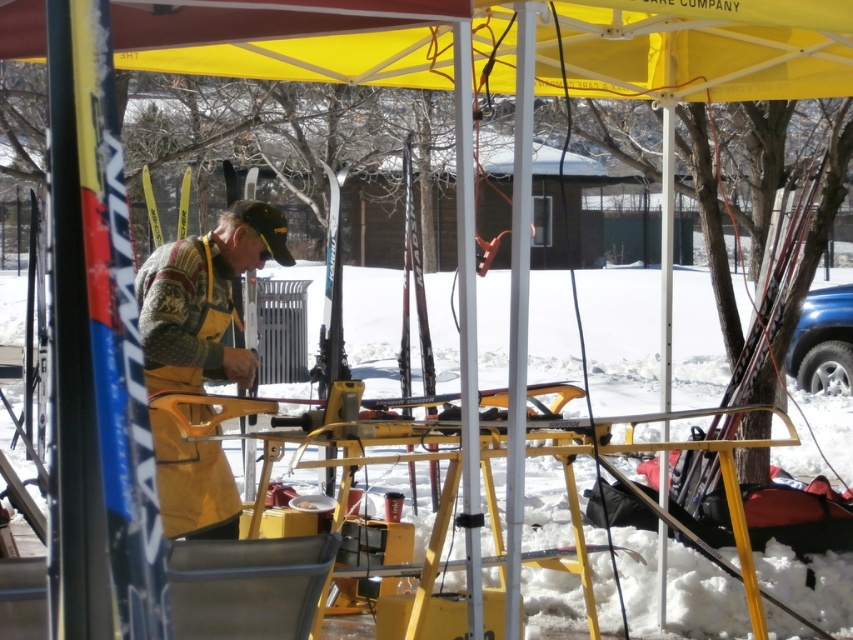
Question: Which object is closer to the camera taking this photo?

Choices:
 (A) knitted sweater at center
 (B) yellow fabric canopy at upper center

Answer: (B)

Question: From the image, what is the correct spatial relationship of yellow fabric canopy at upper center in relation to knitted sweater at center?

Choices:
 (A) below
 (B) above

Answer: (B)

Question: Is yellow fabric canopy at upper center to the right of knitted sweater at center from the viewer's perspective?

Choices:
 (A) no
 (B) yes

Answer: (B)

Question: Which object is farther from the camera taking this photo?

Choices:
 (A) yellow fabric canopy at upper center
 (B) knitted sweater at center

Answer: (B)

Question: Can you confirm if yellow fabric canopy at upper center is positioned above knitted sweater at center?

Choices:
 (A) yes
 (B) no

Answer: (A)